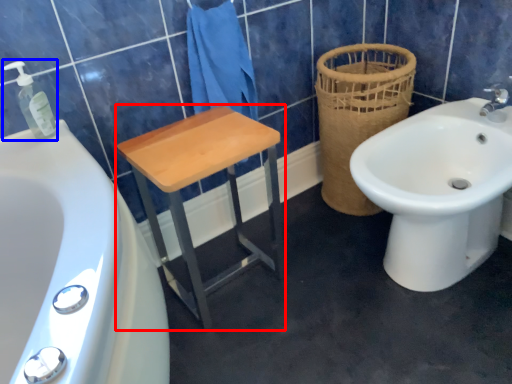
Question: Which point is further to the camera, furniture (highlighted by a red box) or soap dispenser (highlighted by a blue box)?

Choices:
 (A) furniture
 (B) soap dispenser

Answer: (A)